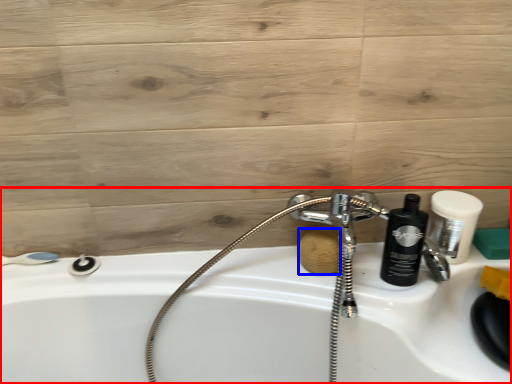
Question: Which object appears farthest to the camera in this image, sink (highlighted by a red box) or soap (highlighted by a blue box)?

Choices:
 (A) sink
 (B) soap

Answer: (B)